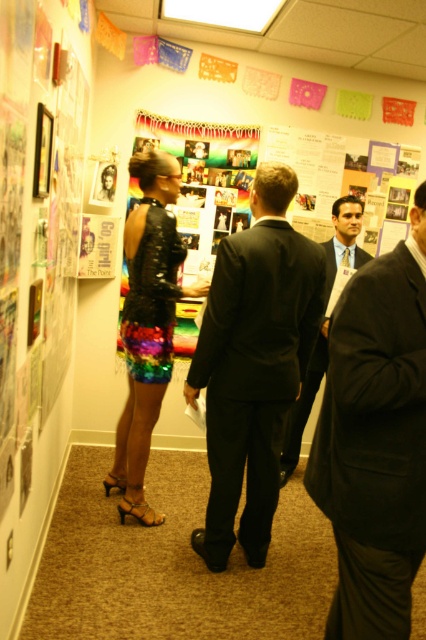
Between shiny sequined dress at center and shiny black suit at center, which one is positioned higher?

Positioned higher is shiny sequined dress at center.

The image size is (426, 640). Identify the location of shiny sequined dress at center. (147, 324).

At what (x,y) coordinates should I click in order to perform the action: click on shiny sequined dress at center. Please return your answer as a coordinate pair (x, y). Image resolution: width=426 pixels, height=640 pixels. Looking at the image, I should click on (147, 324).

Is shiny sequined dress at center to the left of rainbow sequined dress at center from the viewer's perspective?

Yes, shiny sequined dress at center is to the left of rainbow sequined dress at center.

Which is above, shiny sequined dress at center or rainbow sequined dress at center?

rainbow sequined dress at center is above.

The image size is (426, 640). I want to click on shiny sequined dress at center, so click(x=147, y=324).

Is black matte suit at center above shiny black suit at center?

No, black matte suit at center is not above shiny black suit at center.

Measure the distance between point [265,435] and camera.

Point [265,435] and camera are 7.87 feet apart from each other.

The width and height of the screenshot is (426, 640). I want to click on black matte suit at center, so click(253, 364).